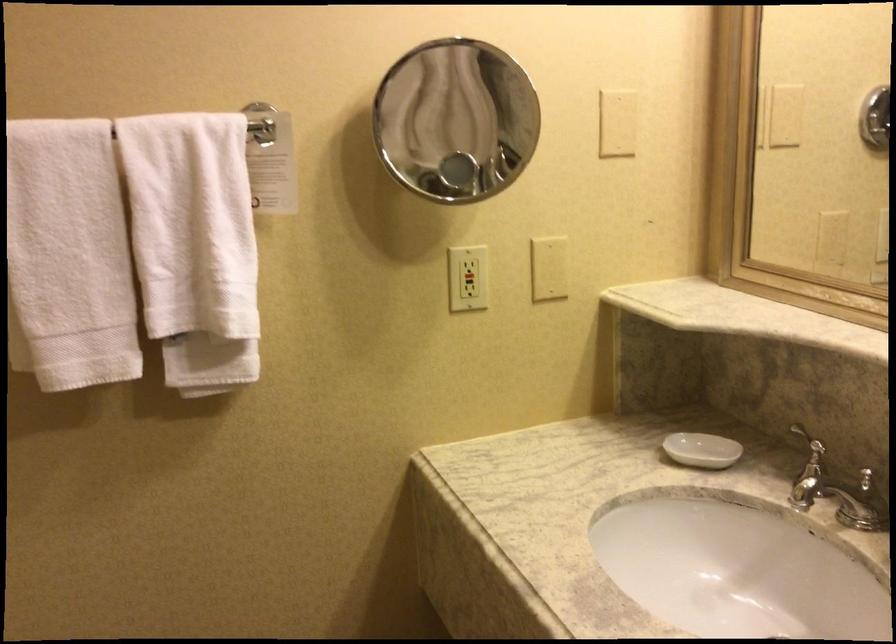
This screenshot has width=896, height=644. What do you see at coordinates (467, 278) in the screenshot?
I see `a black outlet button` at bounding box center [467, 278].